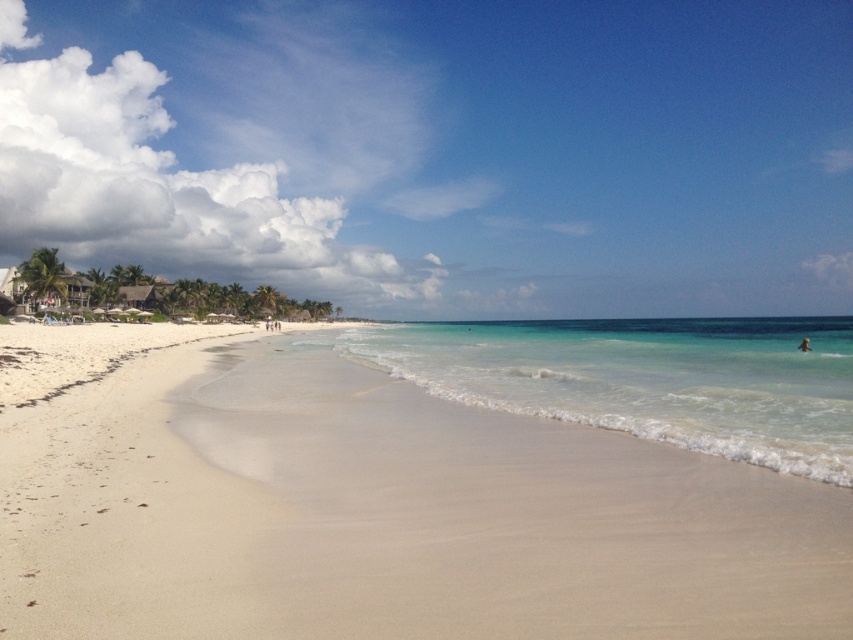
Question: Can you confirm if white sand beach at center is positioned to the left of clear blue water at center?

Choices:
 (A) no
 (B) yes

Answer: (B)

Question: Is white sand beach at center below clear blue water at center?

Choices:
 (A) no
 (B) yes

Answer: (B)

Question: Which point is closer to the camera?

Choices:
 (A) pyautogui.click(x=142, y=372)
 (B) pyautogui.click(x=496, y=371)

Answer: (A)

Question: From the image, what is the correct spatial relationship of white sand beach at center in relation to clear blue water at center?

Choices:
 (A) left
 (B) right

Answer: (A)

Question: Which point appears closest to the camera in this image?

Choices:
 (A) (608, 333)
 (B) (802, 339)
 (C) (576, 593)

Answer: (C)

Question: Which object appears farthest from the camera in this image?

Choices:
 (A) white sand beach at center
 (B) clear blue water at center

Answer: (B)